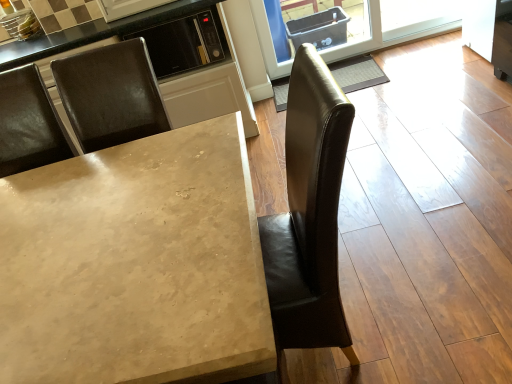
The image size is (512, 384). I want to click on free location above matte beige table at center (from a real-world perspective), so click(92, 230).